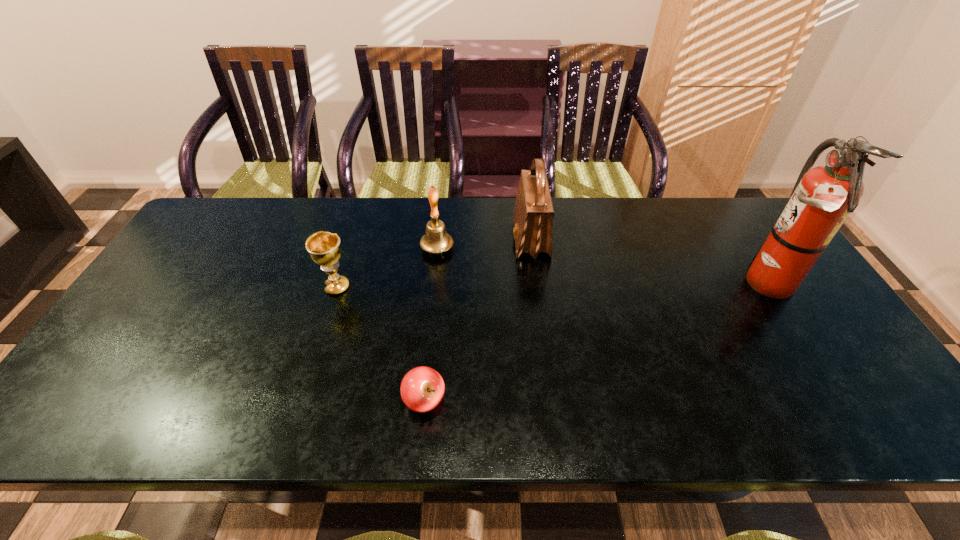
The height and width of the screenshot is (540, 960). In order to click on free space located from the nozzle of the tallest object in this screenshot , I will do `click(673, 282)`.

Find the location of a particular element. This screenshot has height=540, width=960. free point located 0.250m from the nozzle of the tallest object is located at coordinates (644, 282).

Locate an element on the screen. vacant space located 0.170m on the front flap of the fourth shortest object is located at coordinates (458, 239).

Image resolution: width=960 pixels, height=540 pixels. Identify the location of vacant space positioned 0.300m on the front flap of the fourth shortest object. (417, 239).

Where is `free space located 0.230m on the front flap of the fourth shortest object`? This screenshot has height=540, width=960. free space located 0.230m on the front flap of the fourth shortest object is located at coordinates (439, 239).

Find the location of a particular element. The height and width of the screenshot is (540, 960). free region located on the back of the third shortest object is located at coordinates (442, 210).

This screenshot has width=960, height=540. Find the location of `vacant space located on the left of the second shortest object`. vacant space located on the left of the second shortest object is located at coordinates (197, 287).

At what (x,y) coordinates should I click in order to perform the action: click on vacant area situated 0.230m on the back of the shortest object. Please return your answer as a coordinate pair (x, y). The width and height of the screenshot is (960, 540). Looking at the image, I should click on (434, 307).

The image size is (960, 540). Find the location of `shoulder bag present at the far edge`. shoulder bag present at the far edge is located at coordinates (533, 216).

You are a GUI agent. You are given a task and a screenshot of the screen. Output one action in this format:
    pyautogui.click(x=<x>, y=<y>)
    Task: Click on the bell at the far edge
    This screenshot has width=960, height=540.
    Given the screenshot: What is the action you would take?
    pyautogui.click(x=436, y=240)